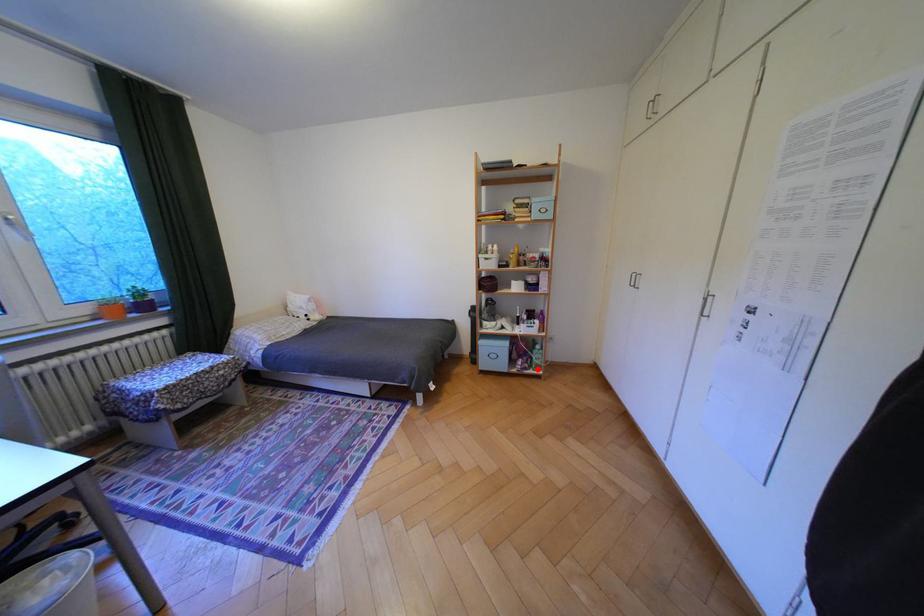
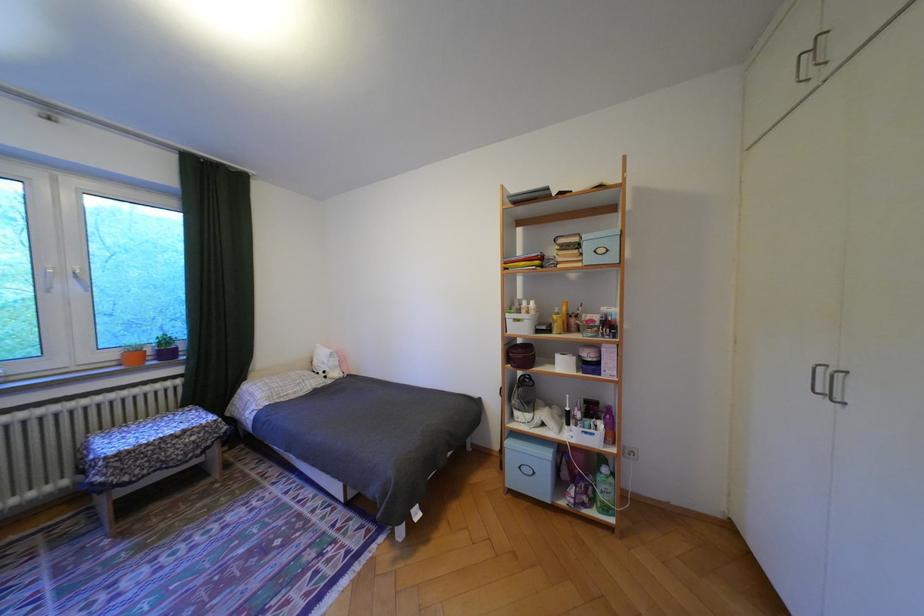
Where in the second image is the point corresponding to the highlighted location from the first image?

(596, 505)